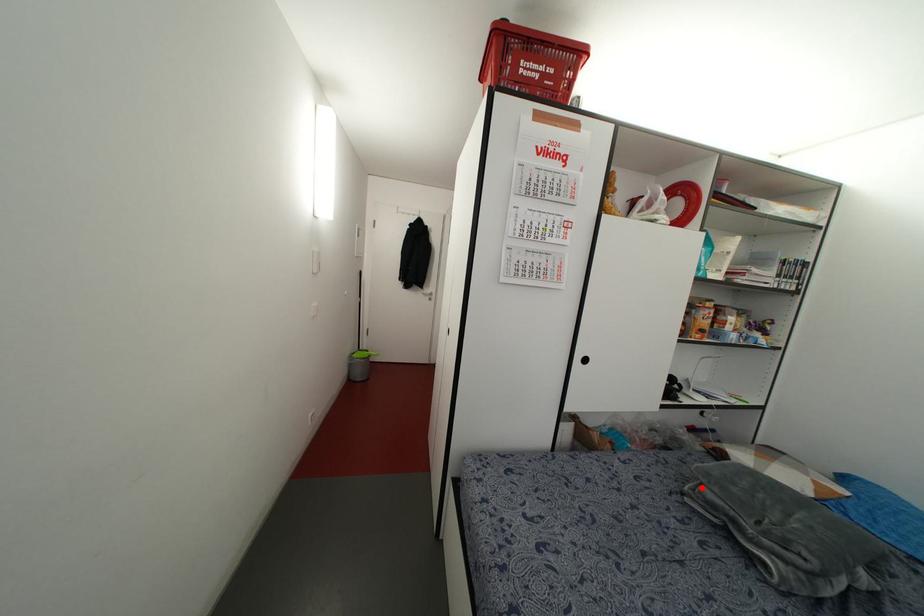
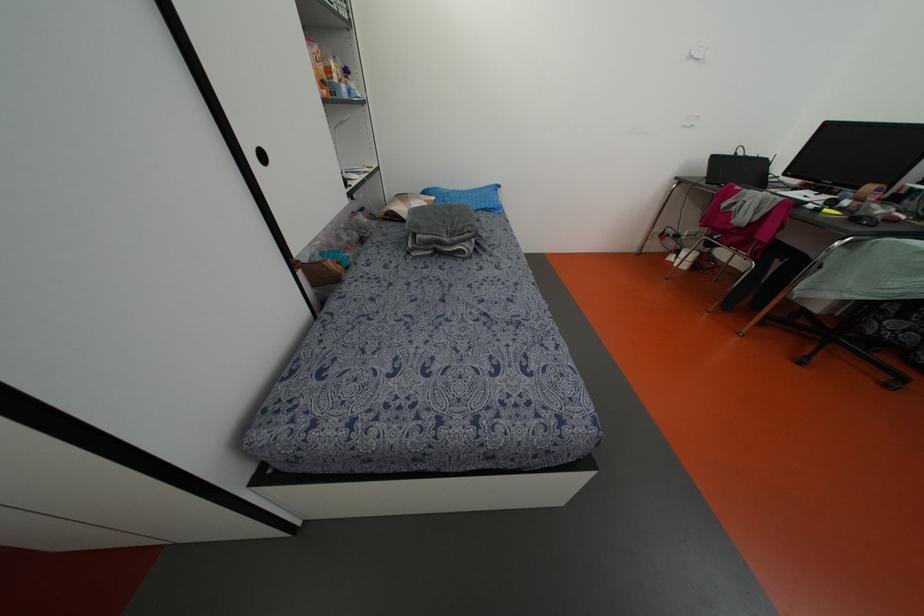
Question: I am providing you with two images of the same scene from different viewpoints. A red point is shown in image1. For the corresponding object point in image2, is it positioned nearer or farther from the camera?

Choices:
 (A) Nearer
 (B) Farther

Answer: (A)